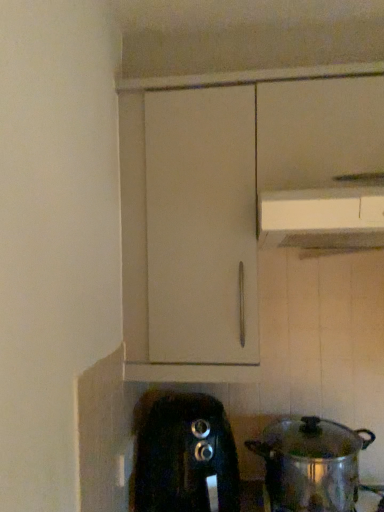
Question: Is white plastic vent at upper center closer to the viewer compared to shiny metallic pot at lower right?

Choices:
 (A) yes
 (B) no

Answer: (A)

Question: Is white plastic vent at upper center not near shiny metallic pot at lower right?

Choices:
 (A) no
 (B) yes

Answer: (A)

Question: Is shiny metallic pot at lower right at the back of white plastic vent at upper center?

Choices:
 (A) yes
 (B) no

Answer: (B)

Question: Is white plastic vent at upper center taller than shiny metallic pot at lower right?

Choices:
 (A) yes
 (B) no

Answer: (B)

Question: Considering the relative sizes of white plastic vent at upper center and shiny metallic pot at lower right in the image provided, is white plastic vent at upper center smaller than shiny metallic pot at lower right?

Choices:
 (A) yes
 (B) no

Answer: (A)

Question: Is point (284, 457) closer or farther from the camera than point (377, 228)?

Choices:
 (A) closer
 (B) farther

Answer: (B)

Question: Considering their positions, is shiny metallic pot at lower right located in front of or behind white plastic vent at upper center?

Choices:
 (A) behind
 (B) front

Answer: (A)

Question: Considering the positions of shiny metallic pot at lower right and white plastic vent at upper center in the image, is shiny metallic pot at lower right bigger or smaller than white plastic vent at upper center?

Choices:
 (A) big
 (B) small

Answer: (A)

Question: From their relative heights in the image, would you say shiny metallic pot at lower right is taller or shorter than white plastic vent at upper center?

Choices:
 (A) short
 (B) tall

Answer: (B)

Question: Based on their sizes in the image, would you say black plastic toaster at lower center is bigger or smaller than shiny metallic pot at lower right?

Choices:
 (A) small
 (B) big

Answer: (B)

Question: Is black plastic toaster at lower center inside or outside of shiny metallic pot at lower right?

Choices:
 (A) inside
 (B) outside

Answer: (B)

Question: From the image's perspective, is black plastic toaster at lower center located above or below shiny metallic pot at lower right?

Choices:
 (A) above
 (B) below

Answer: (B)

Question: In terms of width, does black plastic toaster at lower center look wider or thinner when compared to shiny metallic pot at lower right?

Choices:
 (A) wide
 (B) thin

Answer: (A)

Question: Based on their sizes in the image, would you say white plastic vent at upper center is bigger or smaller than shiny metallic pot at lower right?

Choices:
 (A) big
 (B) small

Answer: (B)

Question: Considering the relative positions of white plastic vent at upper center and shiny metallic pot at lower right in the image provided, is white plastic vent at upper center to the left or to the right of shiny metallic pot at lower right?

Choices:
 (A) left
 (B) right

Answer: (B)